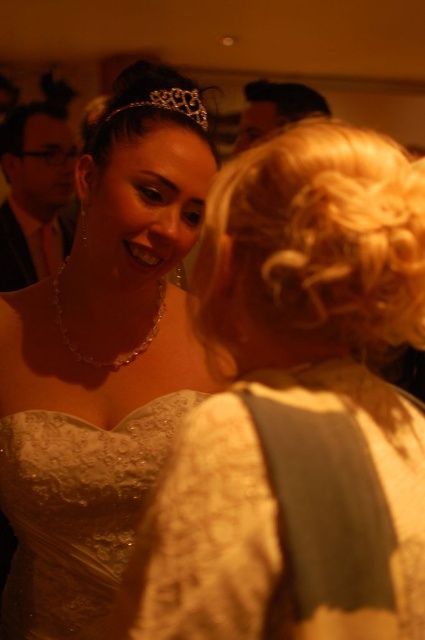
Question: Can you confirm if lace dress at upper left is smaller than matte black suit at left?

Choices:
 (A) yes
 (B) no

Answer: (B)

Question: Can you confirm if lace fabric dress at center is positioned to the right of matte black hair at upper center?

Choices:
 (A) yes
 (B) no

Answer: (B)

Question: Which of the following is the closest to the observer?

Choices:
 (A) (65, 550)
 (B) (260, 317)
 (C) (198, 124)

Answer: (B)

Question: Which of the following is the closest to the observer?

Choices:
 (A) (187, 184)
 (B) (107, 115)
 (C) (82, 472)
 (D) (48, 202)

Answer: (A)

Question: Among these points, which one is nearest to the camera?

Choices:
 (A) (266, 129)
 (B) (129, 106)
 (C) (39, 116)
 (D) (116, 554)

Answer: (B)

Question: Considering the relative positions of matte black hair at upper center and gold metallic tiara at upper center in the image provided, where is matte black hair at upper center located with respect to gold metallic tiara at upper center?

Choices:
 (A) below
 (B) above

Answer: (B)